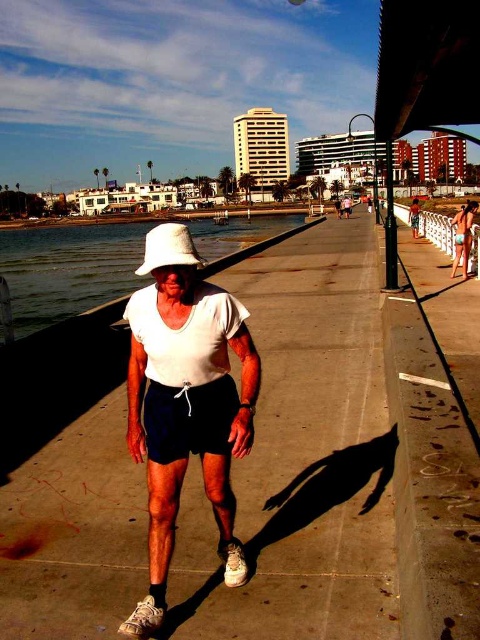
Question: Among these objects, which one is farthest from the camera?

Choices:
 (A) white fabric cowboy hat at center
 (B) clear water at center
 (C) black cotton shorts at center

Answer: (B)

Question: Can you confirm if clear water at center is smaller than white fabric cowboy hat at center?

Choices:
 (A) yes
 (B) no

Answer: (B)

Question: Does black cotton shorts at center have a larger size compared to white fabric cowboy hat at center?

Choices:
 (A) yes
 (B) no

Answer: (B)

Question: Which object appears closest to the camera in this image?

Choices:
 (A) white fabric cowboy hat at center
 (B) clear water at center
 (C) white matte hat at center

Answer: (C)

Question: Considering the relative positions of white matte hat at center and clear water at center in the image provided, where is white matte hat at center located with respect to clear water at center?

Choices:
 (A) right
 (B) left

Answer: (A)

Question: Which of the following is the farthest from the observer?

Choices:
 (A) white fabric cowboy hat at center
 (B) white cotton shirt at center

Answer: (B)